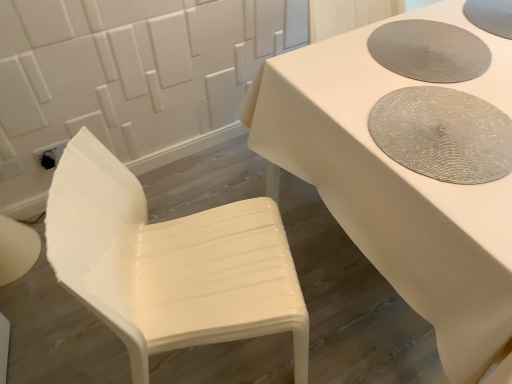
I want to click on free point to the left of textured gray mat at upper right, which is the 3th manhole cover in top-to-bottom order, so click(334, 104).